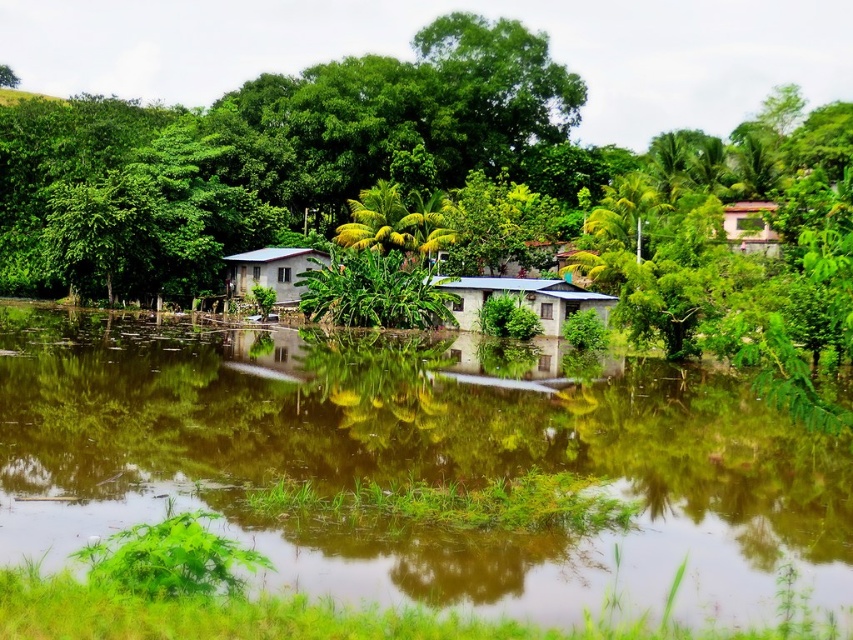
Is brown reflective water at center shorter than pink matte hut at upper right?

Yes.

Which is behind, point (49, 308) or point (746, 246)?

Point (49, 308)

Is point (500, 612) closer to camera compared to point (759, 228)?

Yes.

At what (x,y) coordinates should I click in order to perform the action: click on brown reflective water at center. Please return your answer as a coordinate pair (x, y). The height and width of the screenshot is (640, 853). Looking at the image, I should click on (427, 468).

Can you confirm if matte blue hut at center is bigger than white corrugated metal hut at center?

Indeed, matte blue hut at center has a larger size compared to white corrugated metal hut at center.

Which is more to the right, matte blue hut at center or white corrugated metal hut at center?

matte blue hut at center is more to the right.

Is point (468, 320) closer to camera compared to point (257, 268)?

Yes, point (468, 320) is closer to viewer.

The image size is (853, 640). I want to click on matte blue hut at center, so click(523, 298).

Between matte blue hut at center and pink matte hut at upper right, which one is positioned higher?

Positioned higher is pink matte hut at upper right.

The width and height of the screenshot is (853, 640). What do you see at coordinates (523, 298) in the screenshot?
I see `matte blue hut at center` at bounding box center [523, 298].

The image size is (853, 640). What are the coordinates of `matte blue hut at center` in the screenshot? It's located at [x=523, y=298].